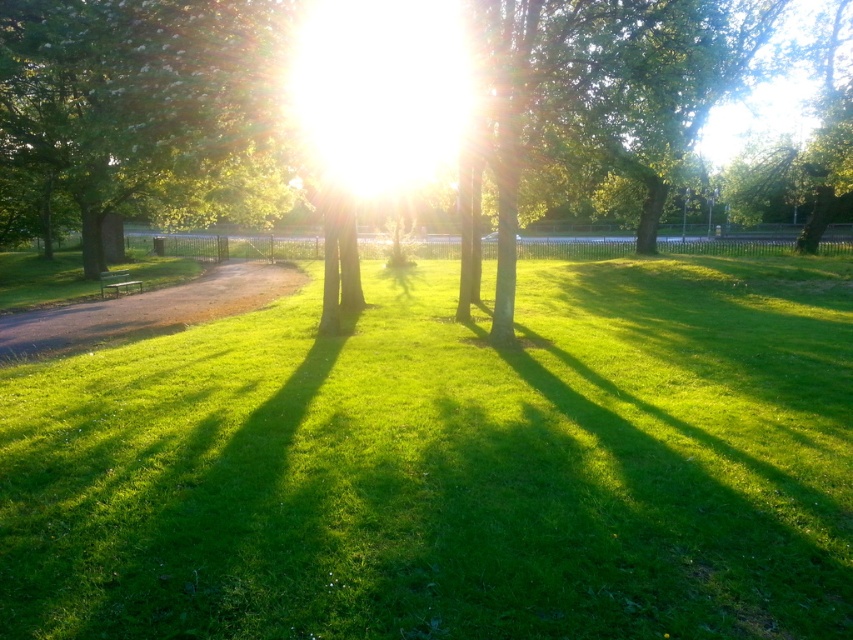
Does green leafy tree at left come behind green metal bench at lower left?

That is False.

Identify the location of green leafy tree at left. The width and height of the screenshot is (853, 640). pos(134,109).

Where is `green leafy tree at left`? The height and width of the screenshot is (640, 853). green leafy tree at left is located at coordinates (134, 109).

Is point (131, 364) positioned behind point (109, 273)?

No, it is not.

Is point (422, 472) in front of point (126, 276)?

Yes, it is in front of point (126, 276).

Is point (321, 481) more distant than point (115, 280)?

That is False.

The width and height of the screenshot is (853, 640). In order to click on green grassy at center in this screenshot , I will do `click(450, 465)`.

Looking at this image, does brown gravel path at left have a smaller size compared to green metal bench at lower left?

No, brown gravel path at left is not smaller than green metal bench at lower left.

Between point (244, 305) and point (132, 280), which one is positioned in front?

Positioned in front is point (244, 305).

Is point (163, 298) positioned in front of point (111, 275)?

Yes, point (163, 298) is in front of point (111, 275).

Image resolution: width=853 pixels, height=640 pixels. Identify the location of brown gravel path at left. [x=148, y=308].